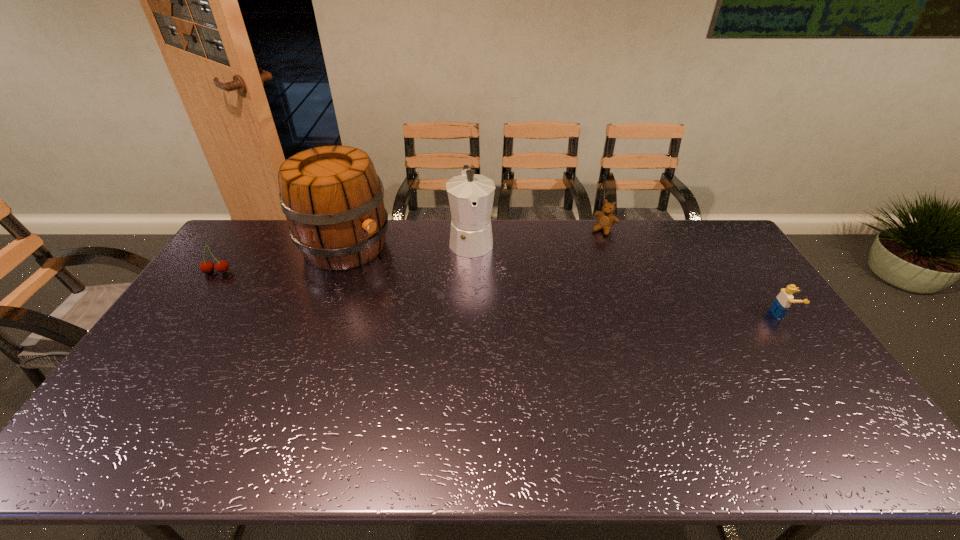
Identify the location of vacant space located 0.320m on the front-facing side of the fourth object from left to right. This screenshot has height=540, width=960. (564, 283).

Where is `vacant region located on the front-facing side of the fourth object from left to right`? The height and width of the screenshot is (540, 960). vacant region located on the front-facing side of the fourth object from left to right is located at coordinates (590, 248).

Identify the location of free location located 0.160m on the front-facing side of the fourth object from left to right. The height and width of the screenshot is (540, 960). (583, 258).

The height and width of the screenshot is (540, 960). I want to click on free space located on the side of the cider where the spigot is located, so click(402, 280).

What are the coordinates of `free point located 0.240m on the side of the cider where the spigot is located` in the screenshot? It's located at (425, 294).

Identify the location of vacant space located on the side of the cider where the spigot is located. The image size is (960, 540). (417, 289).

Locate an element on the screen. coffeepot at the far edge is located at coordinates (470, 195).

This screenshot has height=540, width=960. In order to click on teddy bear that is at the far edge in this screenshot , I will do `click(606, 219)`.

You are a GUI agent. You are given a task and a screenshot of the screen. Output one action in this format:
    pyautogui.click(x=<x>, y=<y>)
    Task: Click on the cider situated at the far edge
    The width and height of the screenshot is (960, 540).
    Given the screenshot: What is the action you would take?
    pyautogui.click(x=332, y=197)

In order to click on object that is at the left edge in this screenshot , I will do `click(221, 266)`.